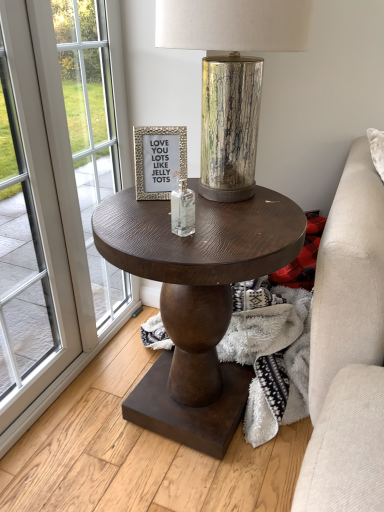
Identify the location of free space behind clear glass bottle at center. (168, 206).